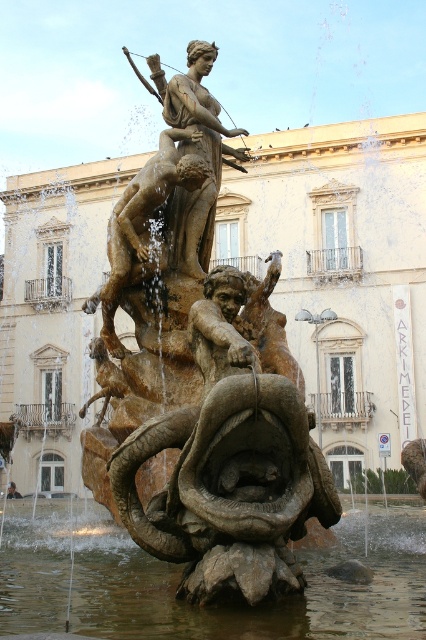
Question: Does translucent stone water at center have a larger size compared to bronze statue at upper center?

Choices:
 (A) no
 (B) yes

Answer: (B)

Question: Which of the following is the closest to the observer?

Choices:
 (A) translucent stone water at center
 (B) bronze statue at upper center

Answer: (A)

Question: Is translucent stone water at center smaller than bronze statue at upper center?

Choices:
 (A) yes
 (B) no

Answer: (B)

Question: Which point appears closest to the camera in this image?

Choices:
 (A) (215, 108)
 (B) (85, 572)

Answer: (B)

Question: Is translucent stone water at center further to the viewer compared to bronze statue at upper center?

Choices:
 (A) no
 (B) yes

Answer: (A)